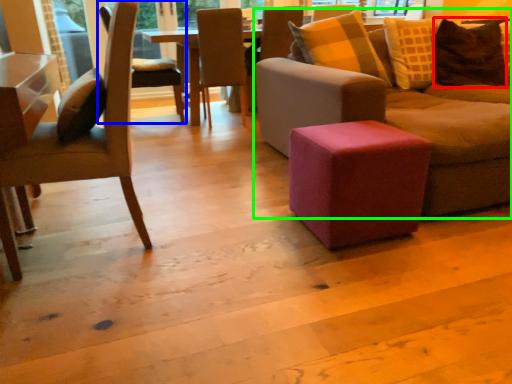
Question: Estimate the real-world distances between objects in this image. Which object is closer to pillow (highlighted by a red box), chair (highlighted by a blue box) or studio couch (highlighted by a green box)?

Choices:
 (A) chair
 (B) studio couch

Answer: (B)